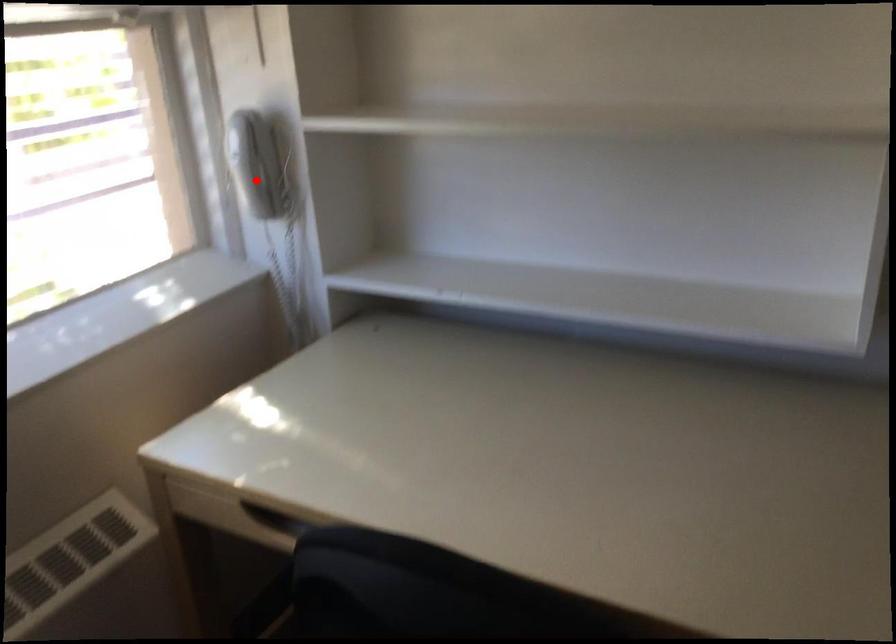
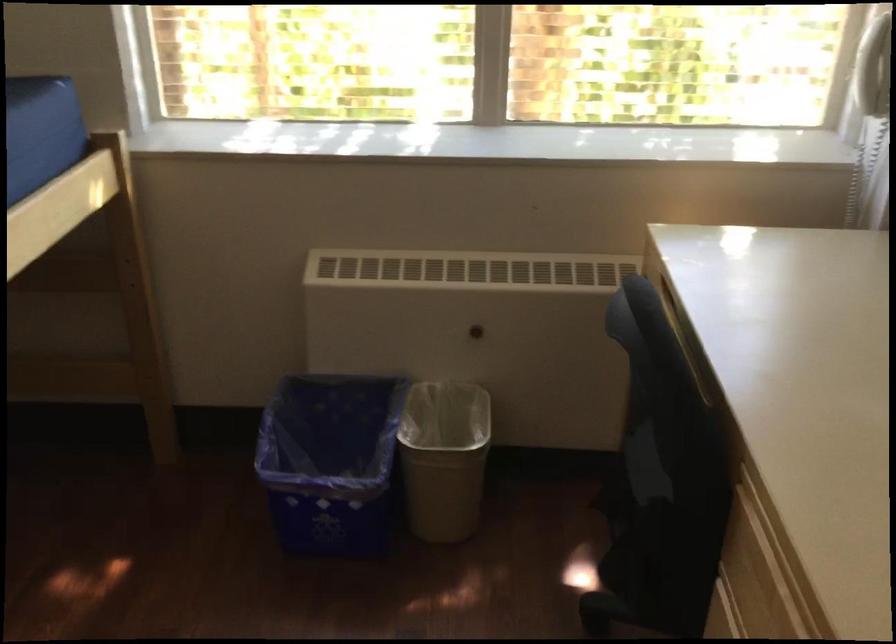
Question: I am providing you with two images of the same scene from different viewpoints. Given a red point in image1, look at the same physical point in image2. Is it:

Choices:
 (A) Closer to the viewpoint
 (B) Farther from the viewpoint

Answer: (B)